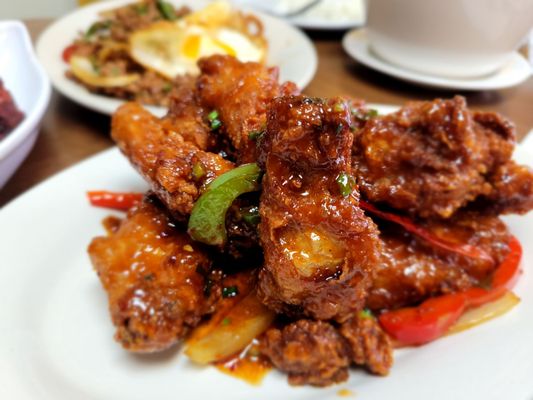
You are a GUI agent. You are given a task and a screenshot of the screen. Output one action in this format:
    pyautogui.click(x=<x>, y=<y>)
    Task: Click on the plate
    This screenshot has height=400, width=533.
    Given the screenshot: What is the action you would take?
    pyautogui.click(x=52, y=203), pyautogui.click(x=90, y=106), pyautogui.click(x=373, y=60), pyautogui.click(x=328, y=26)